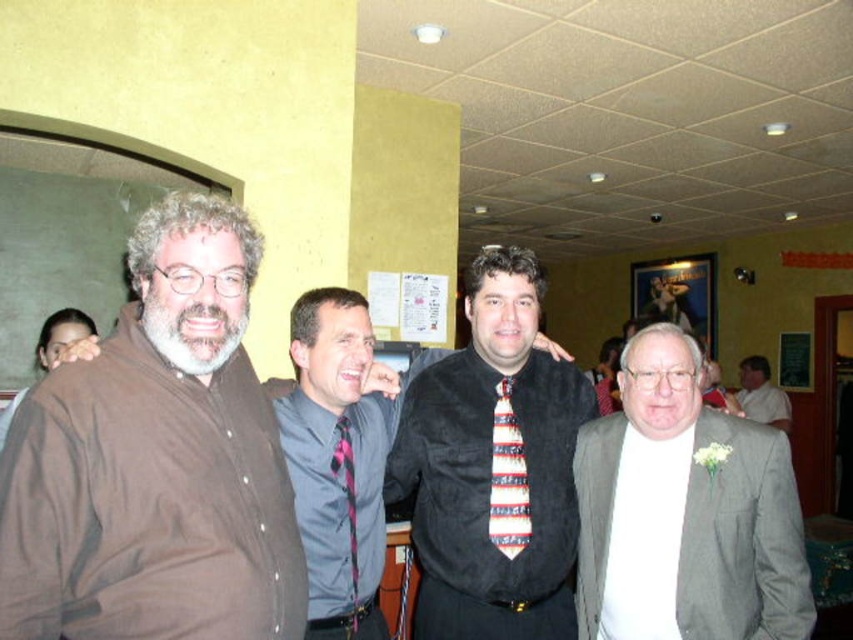
Question: Can you confirm if brown shirt at left is positioned to the left of striped silk tie at center?

Choices:
 (A) no
 (B) yes

Answer: (B)

Question: Which is farther from the black velvet shirt at center?

Choices:
 (A) brown shirt at left
 (B) striped silk tie at center
 (C) pink satin tie at center
 (D) gray wool suit at right

Answer: (A)

Question: Which point is farther from the camera taking this photo?

Choices:
 (A) (346, 420)
 (B) (67, 513)

Answer: (A)

Question: In this image, where is brown shirt at left located relative to pink satin tie at center?

Choices:
 (A) right
 (B) left

Answer: (B)

Question: Does black velvet shirt at center appear on the left side of striped silk tie at center?

Choices:
 (A) yes
 (B) no

Answer: (A)

Question: Which of the following is the farthest from the observer?

Choices:
 (A) pink satin tie at center
 (B) brown matte shirt at left

Answer: (A)